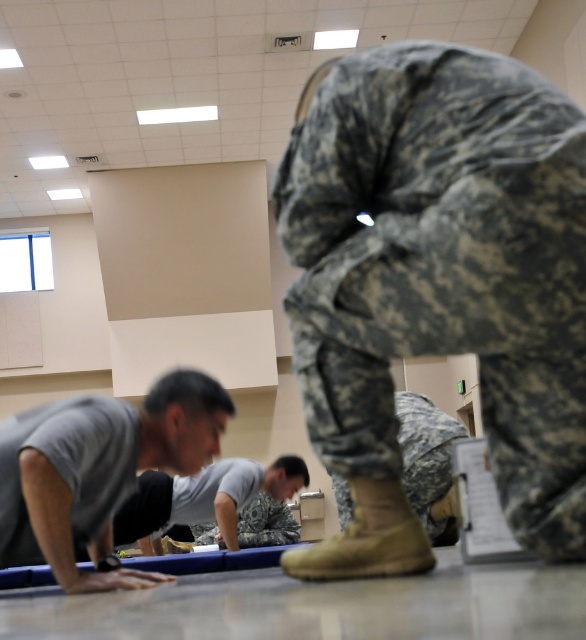
Between point (342, 220) and point (427, 468), which one is positioned behind?

Positioned behind is point (427, 468).

What do you see at coordinates (438, 284) in the screenshot? This screenshot has height=640, width=586. I see `camouflage fabric uniform at upper center` at bounding box center [438, 284].

Where is `camouflage fabric uniform at upper center`? This screenshot has height=640, width=586. camouflage fabric uniform at upper center is located at coordinates (438, 284).

This screenshot has width=586, height=640. In order to click on camouflage fabric uniform at upper center in this screenshot , I will do `click(438, 284)`.

The height and width of the screenshot is (640, 586). I want to click on camouflage fabric uniform at upper center, so (438, 284).

Who is positioned more to the right, camouflage fabric uniform at upper center or gray matte t-shirt at lower left?

camouflage fabric uniform at upper center

Measure the distance between point (381,326) and camera.

Point (381,326) and camera are 1.39 meters apart.

In order to click on camouflage fabric uniform at upper center in this screenshot , I will do 438,284.